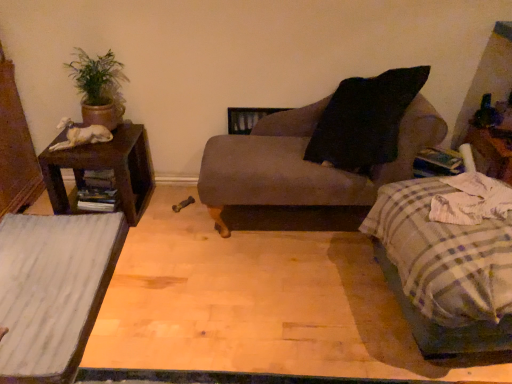
Question: From a real-world perspective, is white wood table at lower left physically located above or below green matte plant at upper left?

Choices:
 (A) above
 (B) below

Answer: (B)

Question: From the image's perspective, is white wood table at lower left above or below green matte plant at upper left?

Choices:
 (A) above
 (B) below

Answer: (B)

Question: Which object is positioned farthest from the plaid fabric bed at lower right?

Choices:
 (A) green matte plant at upper left
 (B) brown wood nightstand at left
 (C) white wood table at lower left
 (D) matte gray chaise at center

Answer: (A)

Question: Which is farther from the plaid fabric bed at lower right?

Choices:
 (A) brown wood nightstand at left
 (B) white wood table at lower left
 (C) matte gray chaise at center
 (D) green matte plant at upper left

Answer: (D)